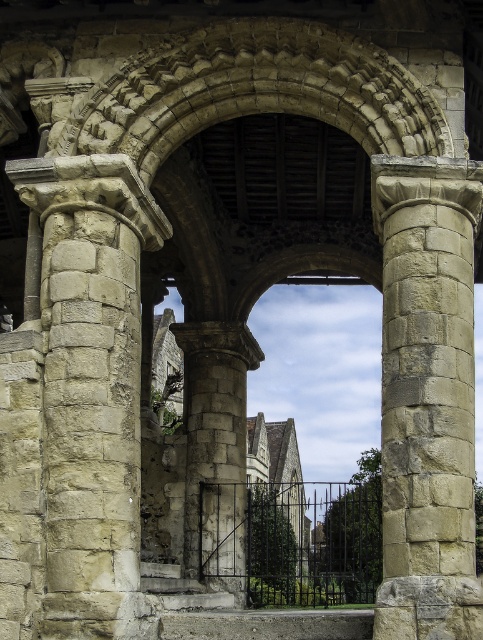
You are an architect inspecting the archway structure. You need to determine which support structure is taller between the beige stone column at center and the gray stone pillar at center. Based on the scene, which one is taller?

The beige stone column at center is taller than the gray stone pillar at center.

You are an architect assessing the structural integrity of the archway. Given that the stone textured column at left and the gray stone pillar at center are both supporting the arch, which of these two supports has a greater width and thus potentially more load capacity?

The stone textured column at left has a greater width than the gray stone pillar at center, meaning it likely has a higher load capacity due to its larger cross section.

You are standing in front of the historic stone archway and want to touch both points on the archway. The first point is at coordinate point[422,348] and the second point is at coordinate point[214,378]. Which point should you reach for first if you want to touch them in the order they appear from your current position?

You should reach for point[214,378] first because it is closer to you than point[422,348], which is further away.